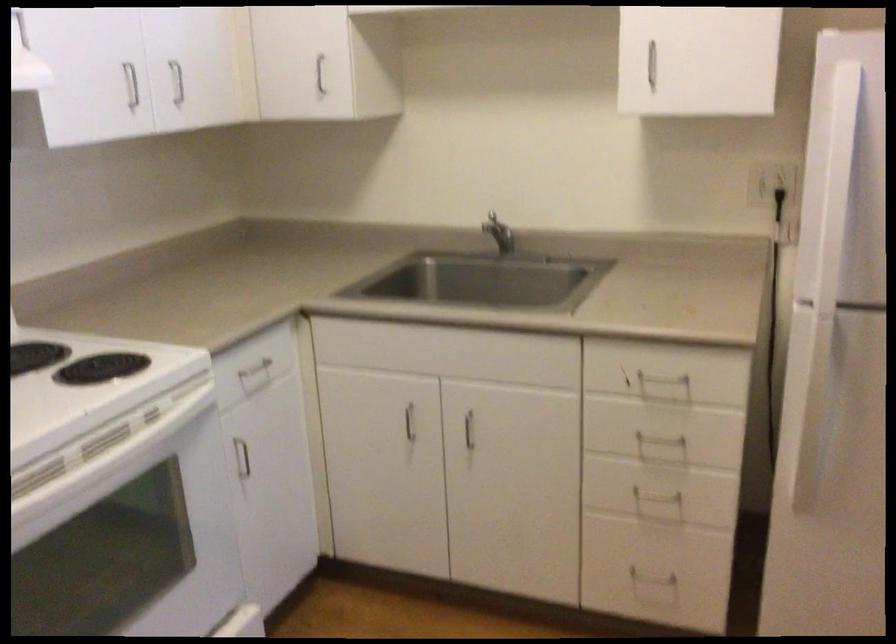
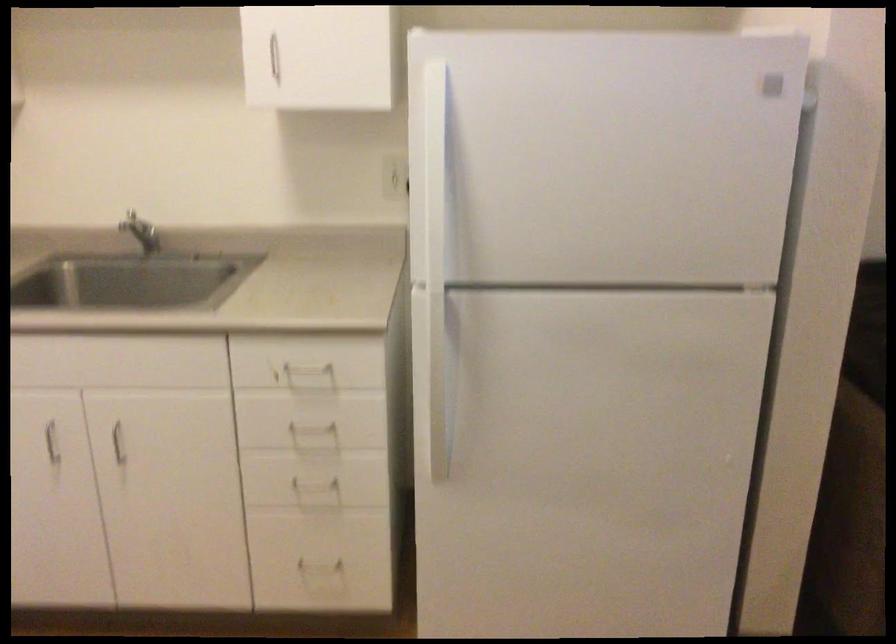
In the second image, find the point that corresponds to the point at 407,422 in the first image.

(52, 442)